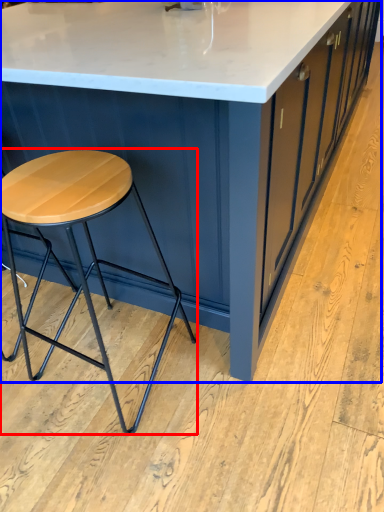
Question: Which point is closer to the camera, stool (highlighted by a red box) or table (highlighted by a blue box)?

Choices:
 (A) stool
 (B) table

Answer: (B)